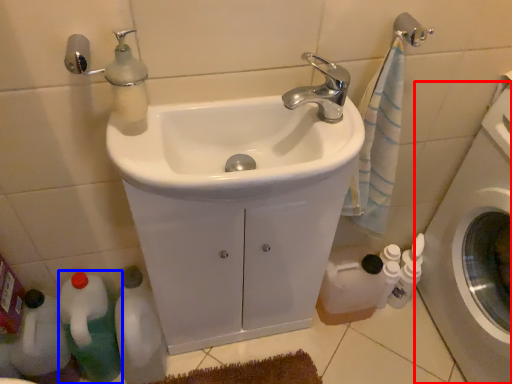
Question: Which object is further to the camera taking this photo, washing machine (highlighted by a red box) or bottle (highlighted by a blue box)?

Choices:
 (A) washing machine
 (B) bottle

Answer: (B)